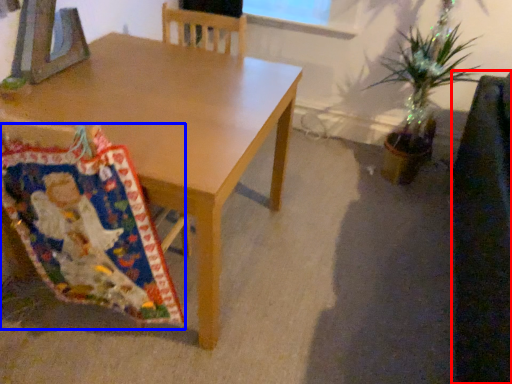
Question: Which object appears closest to the camera in this image, swivel chair (highlighted by a red box) or blanket (highlighted by a blue box)?

Choices:
 (A) swivel chair
 (B) blanket

Answer: (A)